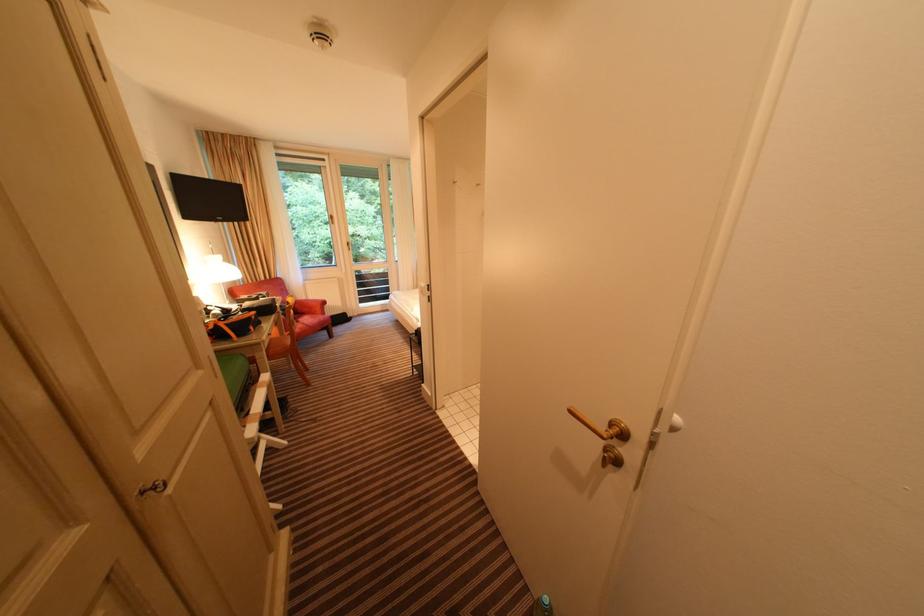
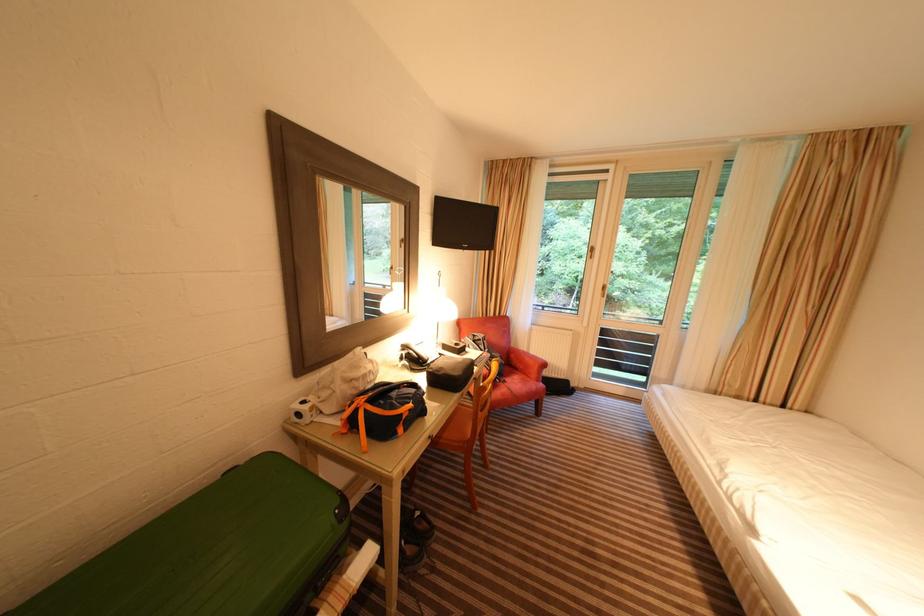
In the second image, find the point that corresponds to (281,318) in the first image.

(463, 399)